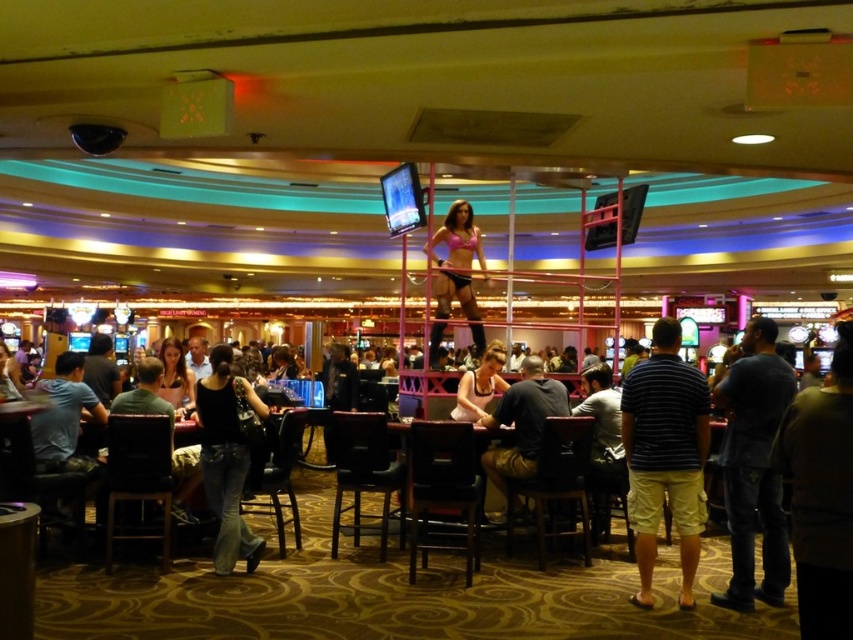
You are a photographer trying to capture a clear photo of the matte black dress at center and the matte pink bikini top at center. Since you want to focus on the dress, which object should you position closer to the camera?

The matte black dress at center has a lesser width compared to the matte pink bikini top at center, so to focus on the dress, you should position the matte black dress at center closer to the camera to make it appear larger in the photo.

What is located at the point with coordinates (456, 275) in the image?

The point with coordinates (456, 275) corresponds to the pink fabric bikini at center.